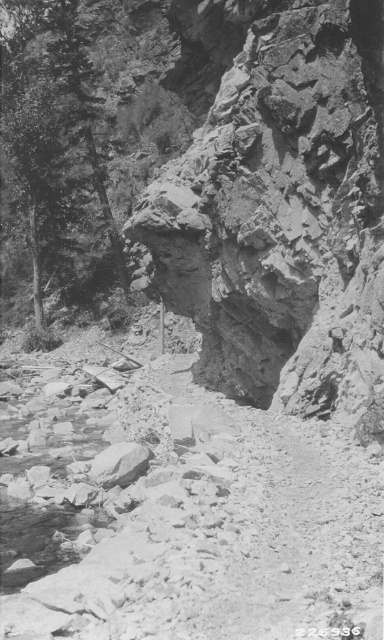
The height and width of the screenshot is (640, 384). What do you see at coordinates (281, 214) in the screenshot? I see `rugged stone cliff at center` at bounding box center [281, 214].

Is point (306, 60) closer to viewer compared to point (16, 192)?

Yes, it is in front of point (16, 192).

Does point (359, 97) come closer to viewer compared to point (59, 209)?

Yes, point (359, 97) is in front of point (59, 209).

At what (x,y) coordinates should I click in order to perform the action: click on rugged stone cliff at center. Please return your answer as a coordinate pair (x, y). Looking at the image, I should click on (281, 214).